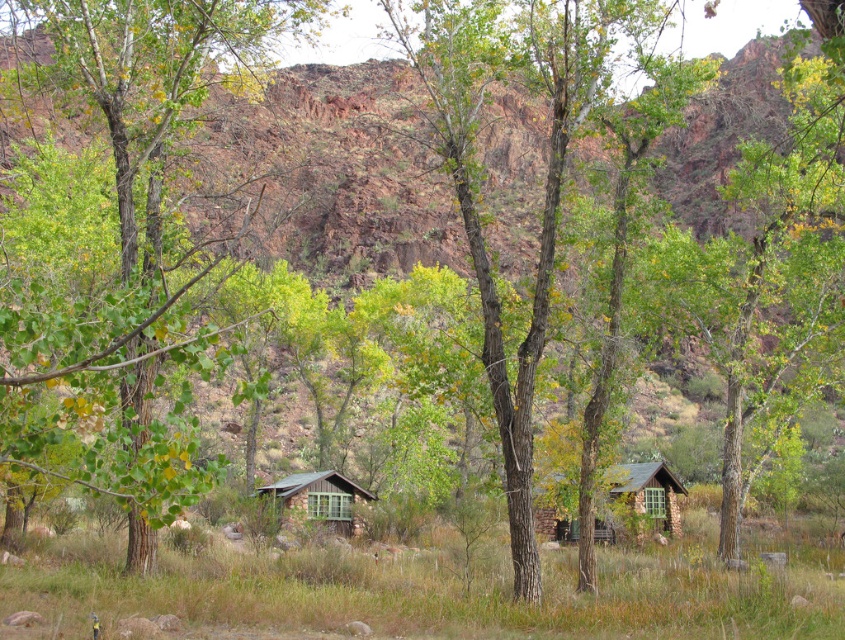
The width and height of the screenshot is (845, 640). What do you see at coordinates (472, 182) in the screenshot?
I see `smooth bark tree at center` at bounding box center [472, 182].

Is smooth bark tree at center wider than rustic stone cabin at center?

Indeed, smooth bark tree at center has a greater width compared to rustic stone cabin at center.

Which is in front, point (603, 74) or point (655, 499)?

Point (603, 74) is in front.

Where is `smooth bark tree at center`? The width and height of the screenshot is (845, 640). smooth bark tree at center is located at coordinates (472, 182).

Between point (184, 248) and point (529, 456), which one is positioned behind?

Positioned behind is point (184, 248).

The height and width of the screenshot is (640, 845). Find the location of `green leafy tree at left`. green leafy tree at left is located at coordinates (132, 259).

Between point (521, 592) and point (335, 493), which one is positioned in front?

Point (521, 592)

How distant is smooth bark tree at center from wooden cabin at center?

They are 20.93 meters apart.

You are a GUI agent. You are given a task and a screenshot of the screen. Output one action in this format:
    pyautogui.click(x=<x>, y=<y>)
    Task: Click on the smooth bark tree at center
    The image size is (845, 640).
    Given the screenshot: What is the action you would take?
    pyautogui.click(x=472, y=182)

Locate an element on the screen. Image resolution: width=845 pixels, height=640 pixels. smooth bark tree at center is located at coordinates (472, 182).